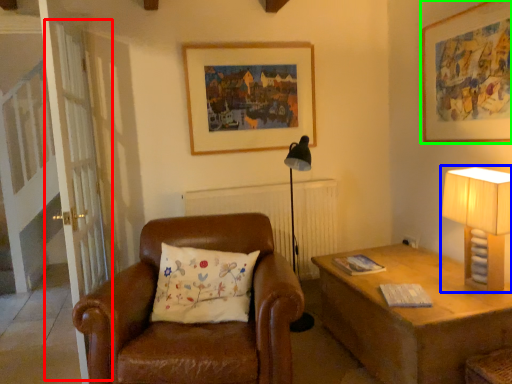
Question: Based on their relative distances, which object is farther from screen door (highlighted by a red box)? Choose from table lamp (highlighted by a blue box) and picture frame (highlighted by a green box).

Choices:
 (A) table lamp
 (B) picture frame

Answer: (B)